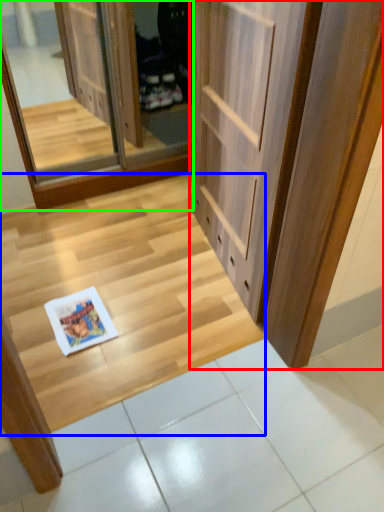
Question: Based on their relative distances, which object is nearer to door (highlighted by a red box)? Choose from stairwell (highlighted by a blue box) and screen door (highlighted by a green box).

Choices:
 (A) stairwell
 (B) screen door

Answer: (A)